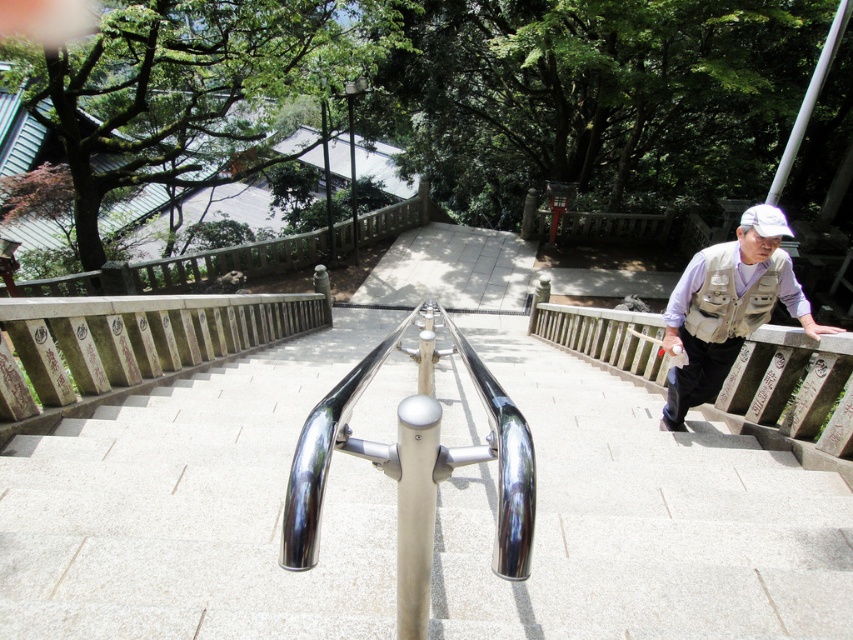
Is point (566, 333) farther from camera compared to point (750, 216)?

Yes, point (566, 333) is behind point (750, 216).

Locate an element on the screen. This screenshot has height=640, width=853. wooden at right is located at coordinates click(x=792, y=387).

Does polished metal handrail at center have a larger size compared to light brown vest at right?

Incorrect, polished metal handrail at center is not larger than light brown vest at right.

Does polished metal handrail at center come in front of light brown vest at right?

Yes, it is.

This screenshot has height=640, width=853. In order to click on polished metal handrail at center in this screenshot , I will do `click(413, 476)`.

Which of these two, polished metal handrail at center or white matte baseball hat at upper right, stands shorter?

Standing shorter between the two is polished metal handrail at center.

Is the position of polished metal handrail at center less distant than that of white matte baseball hat at upper right?

Yes.

Looking at this image, measure the distance between polished metal handrail at center and camera.

A distance of 29.81 inches exists between polished metal handrail at center and camera.

This screenshot has width=853, height=640. I want to click on polished metal handrail at center, so click(x=413, y=476).